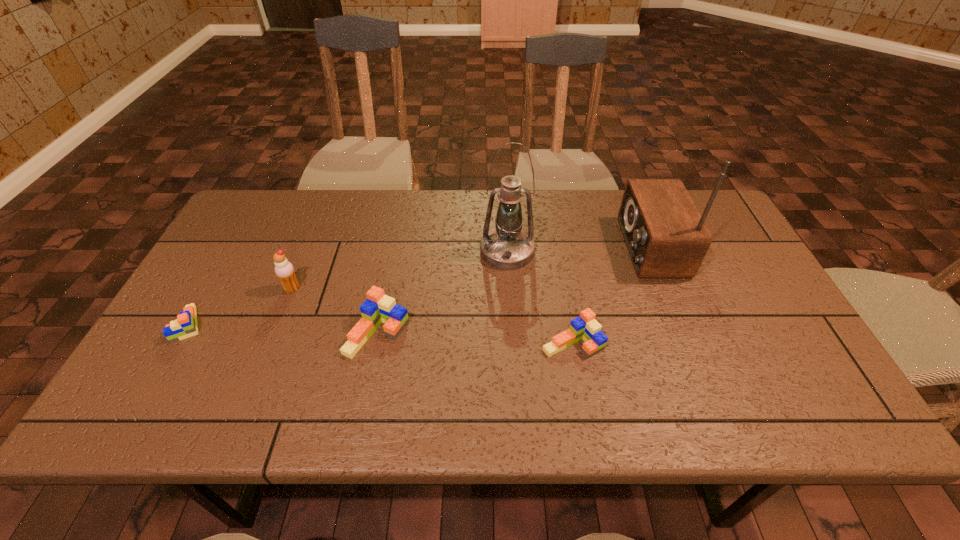
The height and width of the screenshot is (540, 960). In order to click on free space located on the right of the leftmost Lego in this screenshot , I will do `click(346, 324)`.

Find the location of `blank area located on the left of the fourth tallest object`. blank area located on the left of the fourth tallest object is located at coordinates (285, 333).

Where is `vacant space positioned 0.220m on the right of the rightmost Lego`? The image size is (960, 540). vacant space positioned 0.220m on the right of the rightmost Lego is located at coordinates (695, 343).

Where is `vacant position located on the front-facing side of the rightmost object`? The width and height of the screenshot is (960, 540). vacant position located on the front-facing side of the rightmost object is located at coordinates (525, 247).

What are the coordinates of `vacant space situated on the front-facing side of the rightmost object` in the screenshot? It's located at (488, 247).

I want to click on free point located 0.360m on the front-facing side of the rightmost object, so click(498, 247).

Where is `blank space located 0.120m on the right of the oil lamp`? blank space located 0.120m on the right of the oil lamp is located at coordinates (576, 251).

This screenshot has width=960, height=540. In order to click on vacant region located at the front with a straw on the third tallest object in this screenshot , I will do `click(254, 383)`.

Identify the location of radio receiver at the far edge. The height and width of the screenshot is (540, 960). (666, 236).

Image resolution: width=960 pixels, height=540 pixels. I want to click on oil lamp present at the far edge, so click(507, 246).